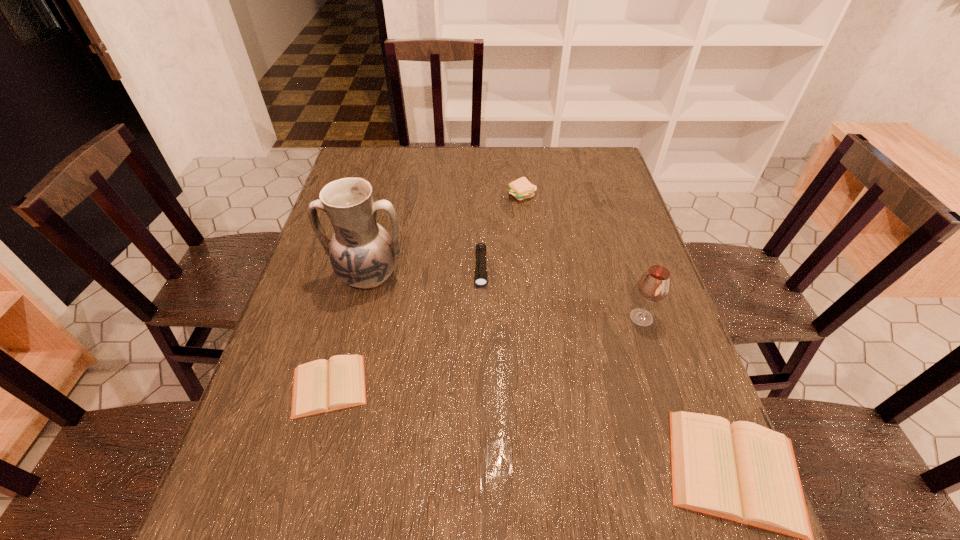
In the image, there is a desktop. At what (x,y) coordinates should I click in order to perform the action: click on vacant space at the far left corner. Please return your answer as a coordinate pair (x, y). This screenshot has width=960, height=540. Looking at the image, I should click on (390, 171).

Image resolution: width=960 pixels, height=540 pixels. I want to click on vacant position at the near left corner of the desktop, so click(x=282, y=442).

Locate an element on the screen. blank region between the fourth shortest object and the second tallest object is located at coordinates (582, 256).

You are a GUI agent. You are given a task and a screenshot of the screen. Output one action in this format:
    pyautogui.click(x=<x>, y=<y>)
    Task: Click on the unoccupied position between the farthest object and the pitcher
    
    Given the screenshot: What is the action you would take?
    pyautogui.click(x=445, y=236)

This screenshot has width=960, height=540. Find the location of `free spot between the fifth shortest object and the pitcher`. free spot between the fifth shortest object and the pitcher is located at coordinates pyautogui.click(x=505, y=297).

In order to click on vacant area that lies between the shorter diary and the fourth farthest object in this screenshot , I will do `click(486, 352)`.

Where is `free space that is in between the fourth shortest object and the shortest object`? This screenshot has height=540, width=960. free space that is in between the fourth shortest object and the shortest object is located at coordinates (425, 291).

I want to click on unoccupied area between the left diary and the fourth shortest object, so click(425, 291).

Locate an element on the screen. vacant space in between the shorter diary and the tallest object is located at coordinates (348, 331).

This screenshot has width=960, height=540. In order to click on unoccupied area between the fourth shortest object and the shortest object in this screenshot , I will do `click(425, 291)`.